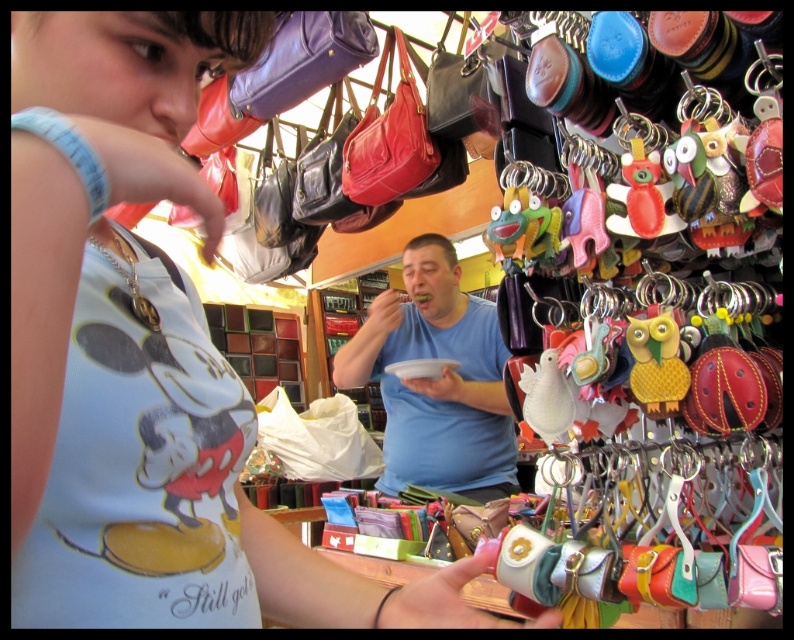
Question: Does matte blue tank top at center appear under blue matte shirt at center?

Choices:
 (A) no
 (B) yes

Answer: (B)

Question: Which point is farther from the camera taking this photo?

Choices:
 (A) (409, 284)
 (B) (128, 577)

Answer: (A)

Question: Is matte blue tank top at center further to camera compared to blue matte shirt at center?

Choices:
 (A) no
 (B) yes

Answer: (A)

Question: Which point is farther to the camera?

Choices:
 (A) (469, 371)
 (B) (102, 358)

Answer: (A)

Question: Is matte blue tank top at center to the left of blue matte shirt at center from the viewer's perspective?

Choices:
 (A) no
 (B) yes

Answer: (B)